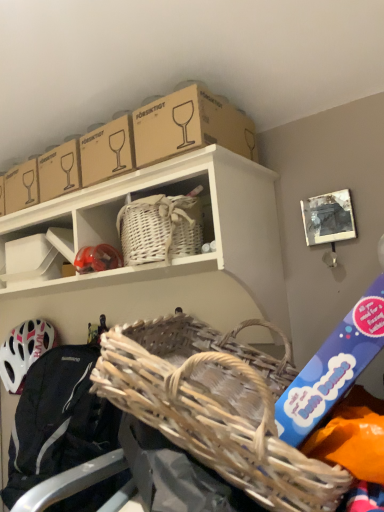
Question: Does woven fabric basket at lower left come behind matte red helmet at center?

Choices:
 (A) no
 (B) yes

Answer: (A)

Question: Does woven fabric basket at lower left have a lesser height compared to matte red helmet at center?

Choices:
 (A) no
 (B) yes

Answer: (A)

Question: Is matte red helmet at center inside woven fabric basket at lower left?

Choices:
 (A) yes
 (B) no

Answer: (B)

Question: Is woven fabric basket at lower left not near matte red helmet at center?

Choices:
 (A) yes
 (B) no

Answer: (B)

Question: Considering the relative sizes of woven fabric basket at lower left and matte red helmet at center in the image provided, is woven fabric basket at lower left taller than matte red helmet at center?

Choices:
 (A) no
 (B) yes

Answer: (B)

Question: Can we say woven fabric basket at lower left lies outside matte red helmet at center?

Choices:
 (A) no
 (B) yes

Answer: (B)

Question: Is there a large distance between brown cardboard box at upper center and white wicker basket at upper center?

Choices:
 (A) no
 (B) yes

Answer: (A)

Question: Is brown cardboard box at upper center beside white wicker basket at upper center?

Choices:
 (A) yes
 (B) no

Answer: (B)

Question: Considering the relative sizes of brown cardboard box at upper center and white wicker basket at upper center in the image provided, is brown cardboard box at upper center smaller than white wicker basket at upper center?

Choices:
 (A) no
 (B) yes

Answer: (B)

Question: From a real-world perspective, is brown cardboard box at upper center over white wicker basket at upper center?

Choices:
 (A) yes
 (B) no

Answer: (A)

Question: Is brown cardboard box at upper center looking in the opposite direction of white wicker basket at upper center?

Choices:
 (A) no
 (B) yes

Answer: (A)

Question: Is brown cardboard box at upper center behind white wicker basket at upper center?

Choices:
 (A) yes
 (B) no

Answer: (A)

Question: Is woven natural picnic basket at center not near woven fabric basket at lower left?

Choices:
 (A) yes
 (B) no

Answer: (B)